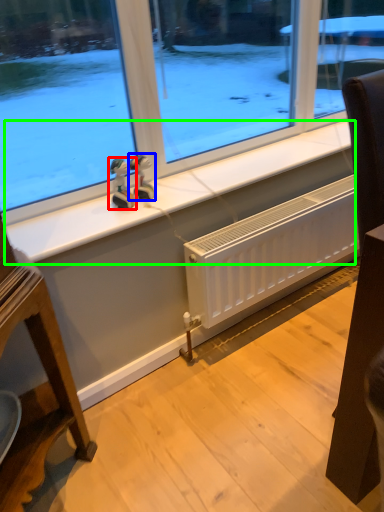
Question: Based on their relative distances, which object is farther from figurine (highlighted by a red box)? Choose from figurine (highlighted by a blue box) and window sill (highlighted by a green box).

Choices:
 (A) figurine
 (B) window sill

Answer: (B)